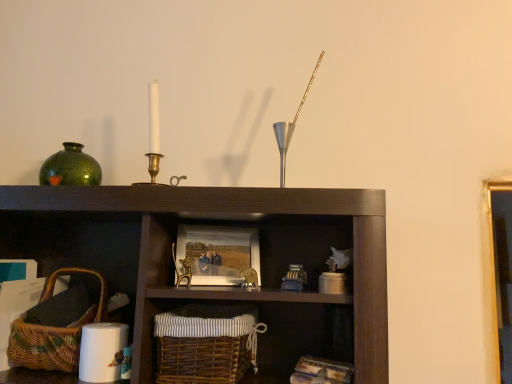
Question: Based on their sizes in the image, would you say green glossy vase at upper left is bigger or smaller than metallic silver candle holder at upper center?

Choices:
 (A) big
 (B) small

Answer: (B)

Question: Is green glossy vase at upper left taller or shorter than metallic silver candle holder at upper center?

Choices:
 (A) short
 (B) tall

Answer: (A)

Question: Which of these objects is positioned farthest from the metallic silver candle holder at upper center?

Choices:
 (A) green glossy vase at upper left
 (B) woven brown basket at lower center, the second basket viewed from the left
 (C) wooden picture frame at center
 (D) woven brown basket at lower left, which appears as the 2th basket when viewed from the right

Answer: (D)

Question: Estimate the real-world distances between objects in this image. Which object is closer to the metallic silver candle holder at upper center?

Choices:
 (A) woven brown basket at lower center, the second basket viewed from the left
 (B) woven brown basket at lower left, which appears as the 2th basket when viewed from the right
 (C) green glossy vase at upper left
 (D) wooden picture frame at center

Answer: (D)